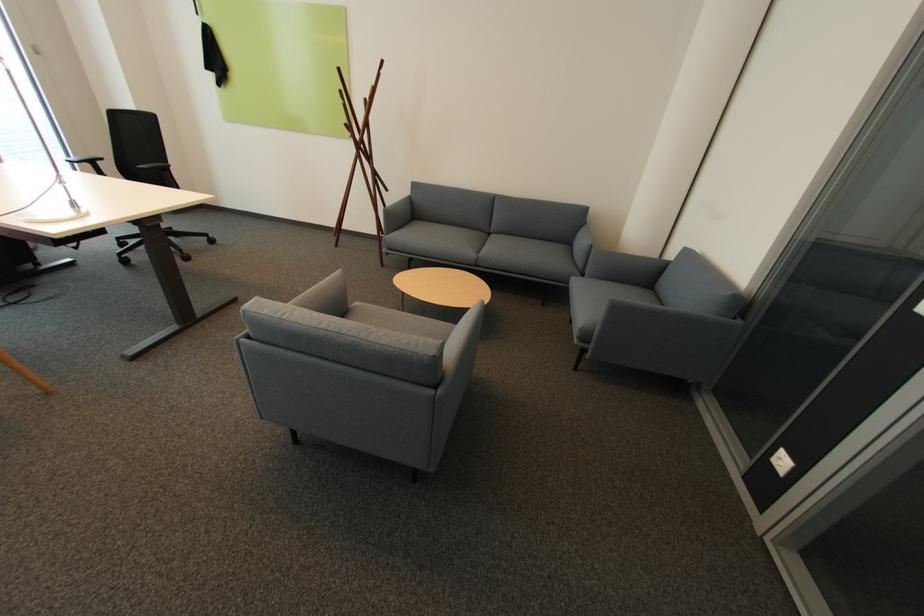
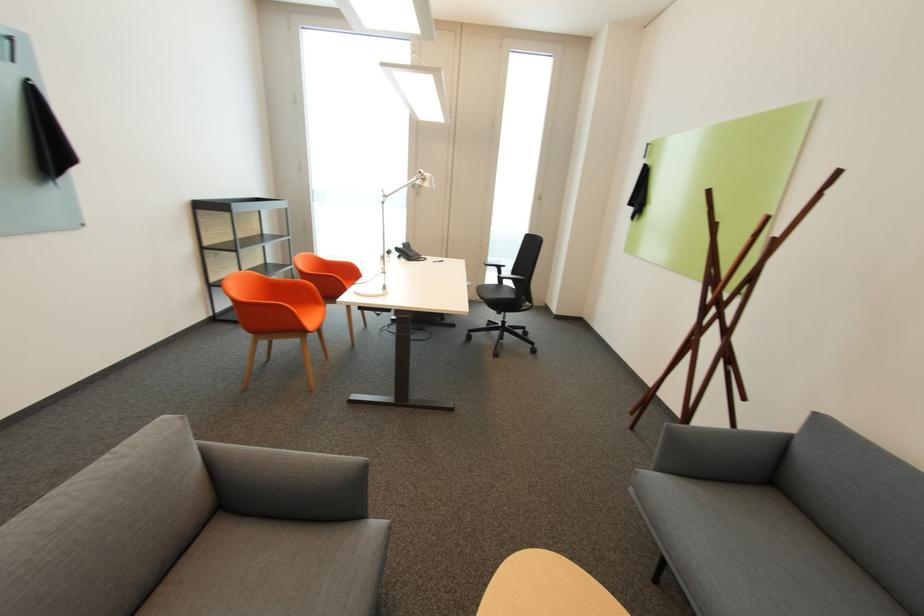
Locate, in the second image, the point that corresponds to [394,235] in the first image.

(663, 469)